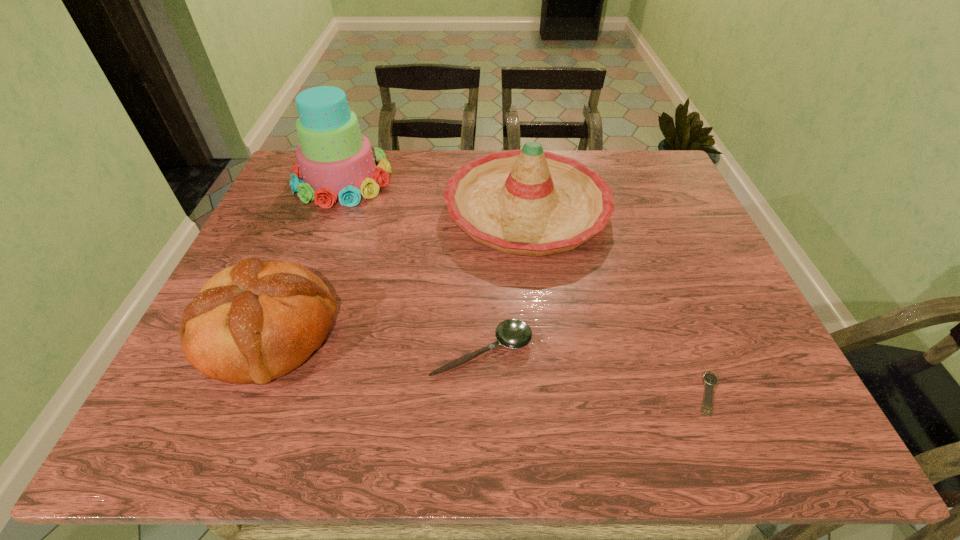
Locate an element on the screen. The image size is (960, 540). free spot located on the right of the rightmost object is located at coordinates (791, 394).

Find the location of a particular element. cake located at the far edge is located at coordinates (336, 162).

Image resolution: width=960 pixels, height=540 pixels. I want to click on sombrero positioned at the far edge, so click(x=531, y=202).

Find the location of a particular element. The height and width of the screenshot is (540, 960). object at the near edge is located at coordinates (710, 379).

The image size is (960, 540). I want to click on cake at the left edge, so click(336, 162).

Find the location of a particular element. bread present at the left edge is located at coordinates (255, 321).

Locate an element on the screen. object that is positioned at the right edge is located at coordinates (710, 379).

I want to click on object located at the far left corner, so click(x=336, y=162).

Where is `object positioned at the near right corner`? object positioned at the near right corner is located at coordinates (710, 379).

In the image, there is a desktop. At what (x,y) coordinates should I click in order to perform the action: click on free region at the far edge. Please return your answer as a coordinate pair (x, y). This screenshot has width=960, height=540. Looking at the image, I should click on (418, 179).